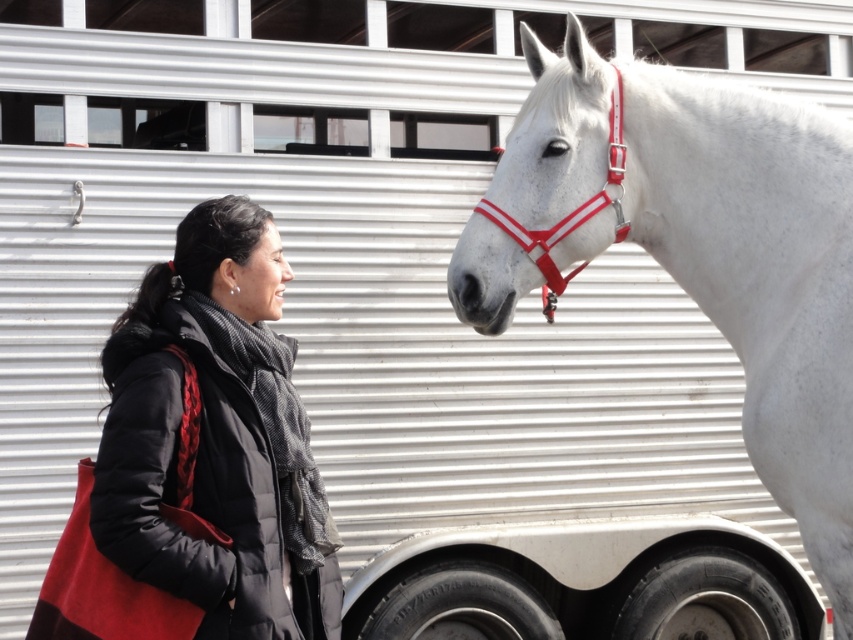
Question: Which object is closer to the camera taking this photo?

Choices:
 (A) black quilted jacket at left
 (B) white glossy horse at center
 (C) shiny red plastic bridle at center

Answer: (A)

Question: Considering the real-world distances, which object is farthest from the black quilted jacket at left?

Choices:
 (A) white glossy horse at center
 (B) shiny red plastic bridle at center

Answer: (A)

Question: Where is white glossy horse at center located in relation to black quilted jacket at left in the image?

Choices:
 (A) left
 (B) right

Answer: (B)

Question: Observing the image, what is the correct spatial positioning of white glossy horse at center in reference to shiny red plastic bridle at center?

Choices:
 (A) below
 (B) above

Answer: (A)

Question: Is white glossy horse at center to the right of shiny red plastic bridle at center from the viewer's perspective?

Choices:
 (A) yes
 (B) no

Answer: (A)

Question: Based on their relative distances, which object is nearer to the black quilted jacket at left?

Choices:
 (A) white glossy horse at center
 (B) shiny red plastic bridle at center

Answer: (B)